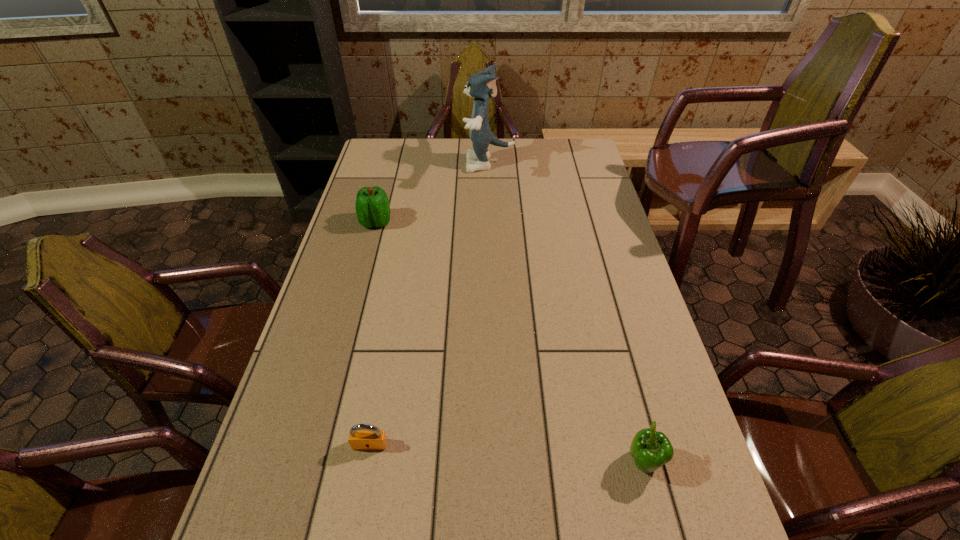
What are the coordinates of `cat` in the screenshot? It's located at (482, 85).

Locate an element on the screen. This screenshot has height=540, width=960. the tallest object is located at coordinates (482, 85).

Image resolution: width=960 pixels, height=540 pixels. Find the location of `the leftmost object`. the leftmost object is located at coordinates (372, 205).

The image size is (960, 540). I want to click on the left bell pepper, so click(372, 205).

Locate an element on the screen. The image size is (960, 540). the nearer bell pepper is located at coordinates (650, 449).

Identify the location of the rightmost object. The image size is (960, 540). (650, 449).

Where is `the third object from right to left`? the third object from right to left is located at coordinates (361, 436).

The width and height of the screenshot is (960, 540). Identify the location of the shortest object. (361, 436).

Image resolution: width=960 pixels, height=540 pixels. Identify the location of free space located 0.320m on the front-facing side of the second object from right to left. (385, 164).

What are the coordinates of `vacant region located on the front-facing side of the second object from right to left` in the screenshot? It's located at (378, 164).